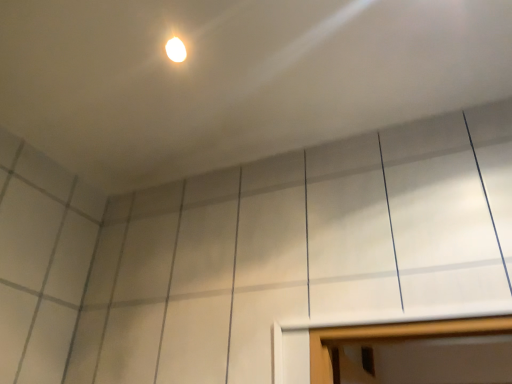
Identify the location of matte white droplight at upper center. Image resolution: width=512 pixels, height=384 pixels. (176, 50).

The height and width of the screenshot is (384, 512). What do you see at coordinates (176, 50) in the screenshot?
I see `matte white droplight at upper center` at bounding box center [176, 50].

Identify the location of matte white droplight at upper center. The image size is (512, 384). pos(176,50).